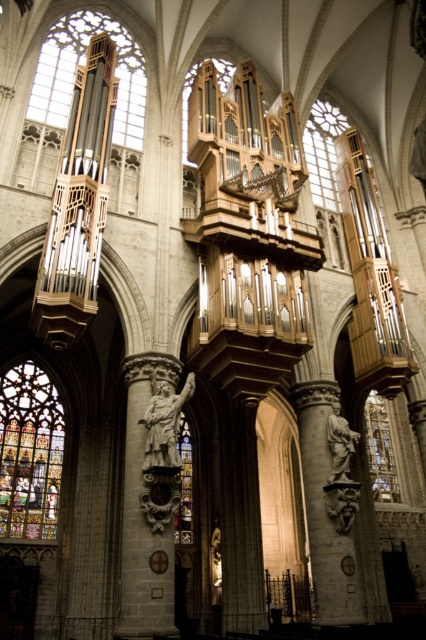
Can you confirm if white stone statue at center is positioned to the left of clear glass at upper right?

Correct, you'll find white stone statue at center to the left of clear glass at upper right.

Does white stone statue at center have a lesser width compared to clear glass at upper right?

Yes.

Find the location of `white stone statue at center`. white stone statue at center is located at coordinates (149, 493).

Can you confirm if white stone statue at center is positioned below multicolored stained glass at lower left?

Yes.

Does white stone statue at center have a larger size compared to multicolored stained glass at lower left?

Indeed, white stone statue at center has a larger size compared to multicolored stained glass at lower left.

Where is `white stone statue at center`? This screenshot has height=640, width=426. white stone statue at center is located at coordinates (149, 493).

Between white stone statue at center and polished bronze statue at center, which one appears on the left side from the viewer's perspective?

From the viewer's perspective, white stone statue at center appears more on the left side.

The height and width of the screenshot is (640, 426). I want to click on white stone statue at center, so click(149, 493).

Is point (166, 632) closer to camera compared to point (336, 433)?

Yes, it is in front of point (336, 433).

Locate an element on the screen. This screenshot has width=426, height=640. white stone statue at center is located at coordinates (149, 493).